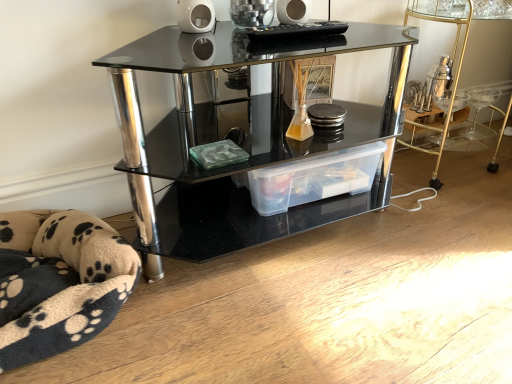
You are a GUI agent. You are given a task and a screenshot of the screen. Output one action in this format:
    pyautogui.click(x=<x>, y=<y>)
    Task: Click on the clear plastic storage container at lower right
    The width and height of the screenshot is (512, 384).
    Given the screenshot: What is the action you would take?
    pyautogui.click(x=453, y=50)

I want to click on transparent plastic storage box at center, so click(x=314, y=178).

Does beige fleece pet bed at lower left come in front of transparent plastic storage box at center?

Yes, it is in front of transparent plastic storage box at center.

Based on their positions, is beige fleece pet bed at lower left located to the left or right of transparent plastic storage box at center?

From the image, it's evident that beige fleece pet bed at lower left is to the left of transparent plastic storage box at center.

Consider the image. Can you confirm if beige fleece pet bed at lower left is smaller than transparent plastic storage box at center?

No, beige fleece pet bed at lower left is not smaller than transparent plastic storage box at center.

Based on the photo, between beige fleece pet bed at lower left and transparent plastic storage box at center, which one has larger width?

beige fleece pet bed at lower left is wider.

The image size is (512, 384). Identify the location of shelf behind the beige fleece pet bed at lower left. (248, 140).

Is black glass shelf at center wider than beige fleece pet bed at lower left?

No.

From a real-world perspective, is black glass shelf at center physically below beige fleece pet bed at lower left?

Actually, black glass shelf at center is physically above beige fleece pet bed at lower left in the real world.

In terms of size, does black glass shelf at center appear bigger or smaller than beige fleece pet bed at lower left?

In the image, black glass shelf at center appears to be larger than beige fleece pet bed at lower left.

Considering the relative sizes of black glass shelf at center and clear plastic storage container at lower right in the image provided, is black glass shelf at center bigger than clear plastic storage container at lower right?

Correct, black glass shelf at center is larger in size than clear plastic storage container at lower right.

Looking at their sizes, would you say black glass shelf at center is wider or thinner than clear plastic storage container at lower right?

In the image, black glass shelf at center appears to be wider than clear plastic storage container at lower right.

Is black glass shelf at center oriented towards clear plastic storage container at lower right?

No, black glass shelf at center is not aimed at clear plastic storage container at lower right.

Measure the distance between black glass shelf at center and transparent plastic storage box at center.

7.33 inches.

Is black glass shelf at center next to transparent plastic storage box at center?

No, black glass shelf at center is not making contact with transparent plastic storage box at center.

From the image's perspective, which one is positioned lower, black glass shelf at center or transparent plastic storage box at center?

transparent plastic storage box at center, from the image's perspective.

Which of these two, transparent plastic storage box at center or black glass shelf at center, is wider?

black glass shelf at center.

Would you consider transparent plastic storage box at center to be distant from black glass shelf at center?

No, transparent plastic storage box at center is in close proximity to black glass shelf at center.

Can you confirm if transparent plastic storage box at center is smaller than black glass shelf at center?

Correct, transparent plastic storage box at center occupies less space than black glass shelf at center.

From the image's perspective, would you say transparent plastic storage box at center is shown under beige fleece pet bed at lower left?

No.

Does transparent plastic storage box at center have a lesser height compared to beige fleece pet bed at lower left?

Yes.

Is transparent plastic storage box at center situated inside beige fleece pet bed at lower left or outside?

transparent plastic storage box at center is spatially situated outside beige fleece pet bed at lower left.

Looking at the image, does clear plastic storage container at lower right seem bigger or smaller compared to beige fleece pet bed at lower left?

clear plastic storage container at lower right is bigger than beige fleece pet bed at lower left.

Is point (410, 15) in front of point (80, 231)?

No, (410, 15) is further to viewer.

Which object is wider, clear plastic storage container at lower right or beige fleece pet bed at lower left?

With larger width is beige fleece pet bed at lower left.

Locate an element on the screen. This screenshot has height=384, width=512. storage box above the beige fleece pet bed at lower left (from the image's perspective) is located at coordinates (314, 178).

You are a GUI agent. You are given a task and a screenshot of the screen. Output one action in this format:
    pyautogui.click(x=<x>, y=<y>)
    Task: Click on the shelf on the right of beige fleece pet bed at lower left
    Image resolution: width=512 pixels, height=384 pixels.
    Given the screenshot: What is the action you would take?
    pyautogui.click(x=248, y=140)

Which object lies further to the anchor point clear plastic storage container at lower right, beige fleece pet bed at lower left or transparent plastic storage box at center?

Among the two, beige fleece pet bed at lower left is located further to clear plastic storage container at lower right.

From the image, which object appears to be farther from black glass shelf at center, beige fleece pet bed at lower left or clear plastic storage container at lower right?

clear plastic storage container at lower right is positioned further to the anchor black glass shelf at center.

Based on the photo, considering their positions, is black glass shelf at center positioned further to transparent plastic storage box at center than beige fleece pet bed at lower left?

beige fleece pet bed at lower left lies further to transparent plastic storage box at center than the other object.

Looking at the image, which one is located further to beige fleece pet bed at lower left, transparent plastic storage box at center or black glass shelf at center?

transparent plastic storage box at center is further to beige fleece pet bed at lower left.

Considering their positions, is beige fleece pet bed at lower left positioned closer to black glass shelf at center than transparent plastic storage box at center?

transparent plastic storage box at center.

Based on their spatial positions, is clear plastic storage container at lower right or black glass shelf at center closer to beige fleece pet bed at lower left?

black glass shelf at center.

Based on their spatial positions, is clear plastic storage container at lower right or transparent plastic storage box at center closer to beige fleece pet bed at lower left?

transparent plastic storage box at center.

Considering their positions, is clear plastic storage container at lower right positioned closer to black glass shelf at center than transparent plastic storage box at center?

transparent plastic storage box at center is closer to black glass shelf at center.

Where is `shelf located between beige fleece pet bed at lower left and transparent plastic storage box at center in the left-right direction`? shelf located between beige fleece pet bed at lower left and transparent plastic storage box at center in the left-right direction is located at coordinates (248, 140).

This screenshot has height=384, width=512. Identify the location of storage box situated between black glass shelf at center and clear plastic storage container at lower right from left to right. (314, 178).

Where is `storage box between beige fleece pet bed at lower left and clear plastic storage container at lower right in the horizontal direction`? The width and height of the screenshot is (512, 384). storage box between beige fleece pet bed at lower left and clear plastic storage container at lower right in the horizontal direction is located at coordinates (314, 178).

The image size is (512, 384). I want to click on shelf between beige fleece pet bed at lower left and clear plastic storage container at lower right, so click(x=248, y=140).